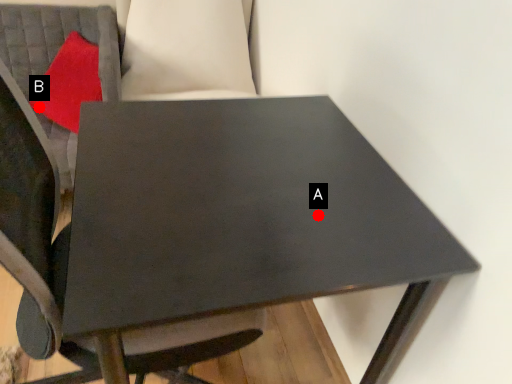
Question: Two points are circled on the image, labeled by A and B beside each circle. Which point appears farthest from the camera in this image?

Choices:
 (A) A is further
 (B) B is further

Answer: (B)